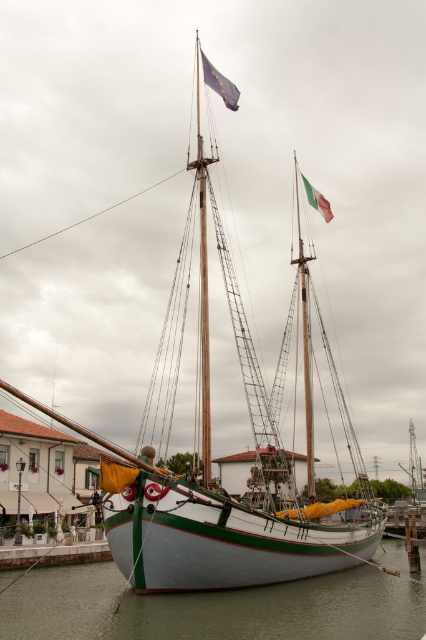
Question: Estimate the real-world distances between objects in this image. Which object is closer to the green matte water at lower center?

Choices:
 (A) yellow fabric at center
 (B) green fabric flag at upper right
 (C) blue fabric flag at upper center

Answer: (A)

Question: Among these objects, which one is nearest to the camera?

Choices:
 (A) green matte water at lower center
 (B) green fabric flag at upper right

Answer: (A)

Question: Can you confirm if green matte water at lower center is positioned to the left of green fabric flag at upper right?

Choices:
 (A) yes
 (B) no

Answer: (A)

Question: Can you confirm if yellow fabric at center is thinner than green fabric flag at upper right?

Choices:
 (A) yes
 (B) no

Answer: (A)

Question: Is blue fabric flag at upper center wider than green fabric flag at upper right?

Choices:
 (A) yes
 (B) no

Answer: (B)

Question: Considering the real-world distances, which object is closest to the blue fabric flag at upper center?

Choices:
 (A) green fabric flag at upper right
 (B) yellow fabric at center

Answer: (A)